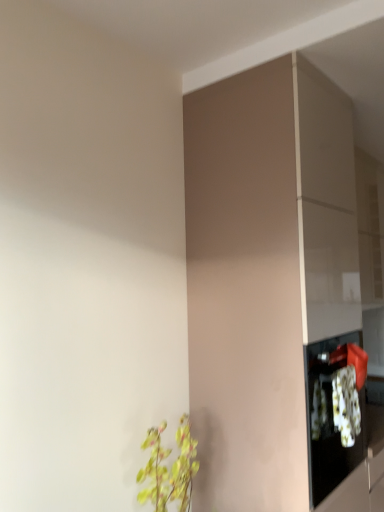
Question: From a real-world perspective, is green leafy plant at lower left physically below matte brown cabinet at center?

Choices:
 (A) no
 (B) yes

Answer: (B)

Question: Can you confirm if green leafy plant at lower left is bigger than matte brown cabinet at center?

Choices:
 (A) yes
 (B) no

Answer: (B)

Question: Does green leafy plant at lower left have a lesser width compared to matte brown cabinet at center?

Choices:
 (A) no
 (B) yes

Answer: (B)

Question: From the image's perspective, is green leafy plant at lower left beneath matte brown cabinet at center?

Choices:
 (A) no
 (B) yes

Answer: (B)

Question: From a real-world perspective, is green leafy plant at lower left on matte brown cabinet at center?

Choices:
 (A) no
 (B) yes

Answer: (A)

Question: Is green leafy plant at lower left outside matte brown cabinet at center?

Choices:
 (A) no
 (B) yes

Answer: (B)

Question: Can you confirm if matte brown cabinet at center is taller than green leafy plant at lower left?

Choices:
 (A) yes
 (B) no

Answer: (A)

Question: From the image's perspective, is matte brown cabinet at center under green leafy plant at lower left?

Choices:
 (A) yes
 (B) no

Answer: (B)

Question: From a real-world perspective, is matte brown cabinet at center beneath green leafy plant at lower left?

Choices:
 (A) yes
 (B) no

Answer: (B)

Question: Is matte brown cabinet at center located outside green leafy plant at lower left?

Choices:
 (A) yes
 (B) no

Answer: (A)

Question: Is matte brown cabinet at center shorter than green leafy plant at lower left?

Choices:
 (A) no
 (B) yes

Answer: (A)

Question: Is matte brown cabinet at center smaller than green leafy plant at lower left?

Choices:
 (A) no
 (B) yes

Answer: (A)

Question: Which is correct: matte brown cabinet at center is inside green leafy plant at lower left, or outside of it?

Choices:
 (A) inside
 (B) outside

Answer: (B)